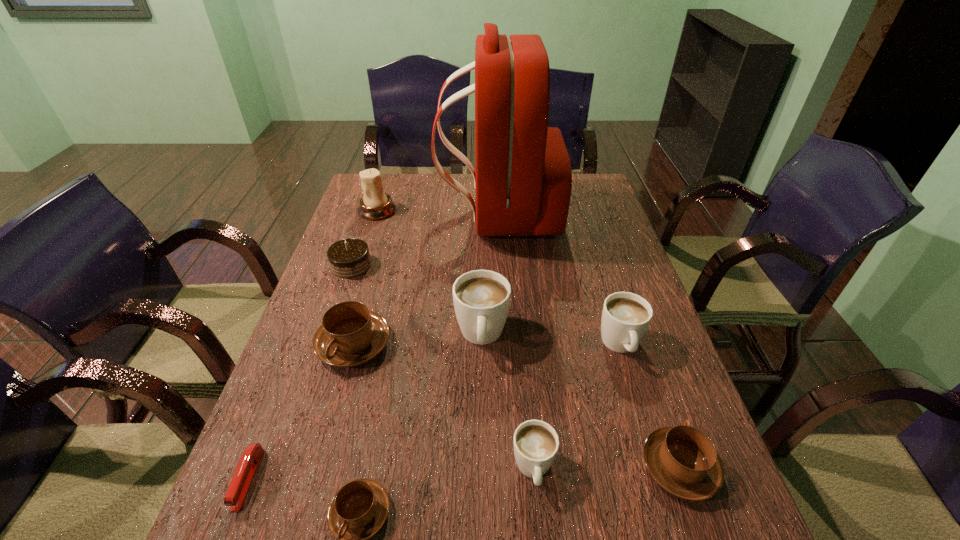
Find the location of a particular element. The width and height of the screenshot is (960, 540). object present at the far left corner is located at coordinates (375, 204).

Locate an element on the screen. The image size is (960, 540). vacant space at the far edge is located at coordinates (449, 174).

Image resolution: width=960 pixels, height=540 pixels. Identify the location of vacant region at the left edge. (335, 444).

This screenshot has height=540, width=960. I want to click on free space at the right edge of the desktop, so click(x=616, y=360).

Where is `blank space at the far left corner of the desktop`? The width and height of the screenshot is (960, 540). blank space at the far left corner of the desktop is located at coordinates (399, 186).

In the image, there is a desktop. At what (x,y) coordinates should I click in order to perform the action: click on vacant space at the far right corner. Please return your answer as a coordinate pair (x, y). The height and width of the screenshot is (540, 960). Looking at the image, I should click on (571, 206).

Identify the location of free spot between the rightmost brown cappuccino and the backpack. (588, 341).

Locate an element on the screen. This screenshot has width=960, height=540. vacant area that lies between the tallest object and the nearest white cappuccino is located at coordinates (516, 342).

Locate an element on the screen. free spot between the farthest brown cappuccino and the rightmost brown cappuccino is located at coordinates (516, 406).

Locate an element on the screen. This screenshot has height=540, width=960. vacant space that's between the second tallest cappuccino and the rightmost brown cappuccino is located at coordinates (650, 406).